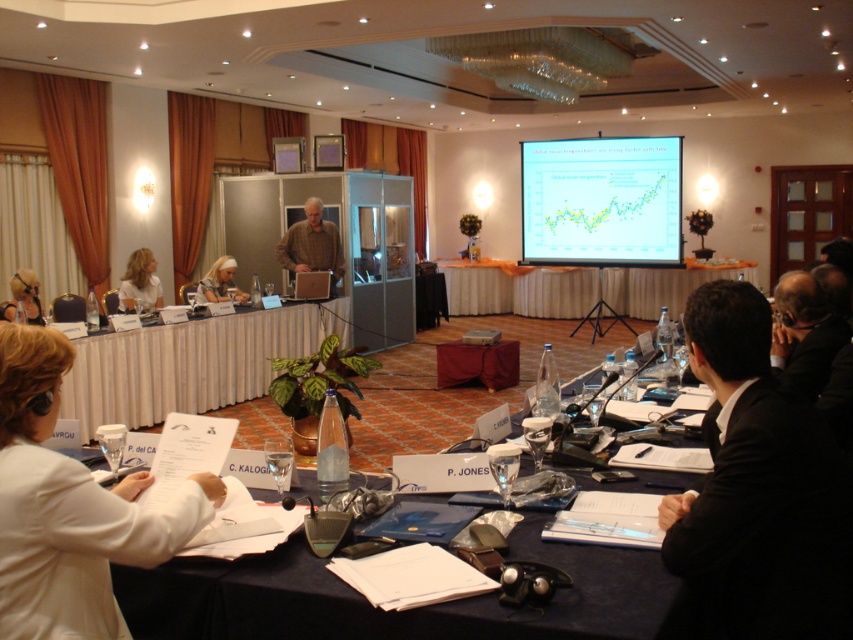
Question: Which object is the closest to the black suit at right?

Choices:
 (A) white paper at center
 (B) white hair at center
 (C) blonde hair at upper left
 (D) plaid wool sweater at center

Answer: (A)

Question: Which point appears closest to the camera in this image?

Choices:
 (A) (216, 284)
 (B) (132, 284)
 (C) (19, 276)

Answer: (C)

Question: Does white paper at center appear on the right side of blonde hair at upper left?

Choices:
 (A) yes
 (B) no

Answer: (A)

Question: Is plaid wool sweater at center positioned in front of matte black laptop at left?

Choices:
 (A) yes
 (B) no

Answer: (B)

Question: Can you confirm if matte black laptop at left is bigger than white hair at center?

Choices:
 (A) yes
 (B) no

Answer: (B)

Question: Among these objects, which one is farthest from the camera?

Choices:
 (A) plaid wool sweater at center
 (B) blonde hair at upper left
 (C) matte black laptop at left
 (D) white paper at center

Answer: (A)